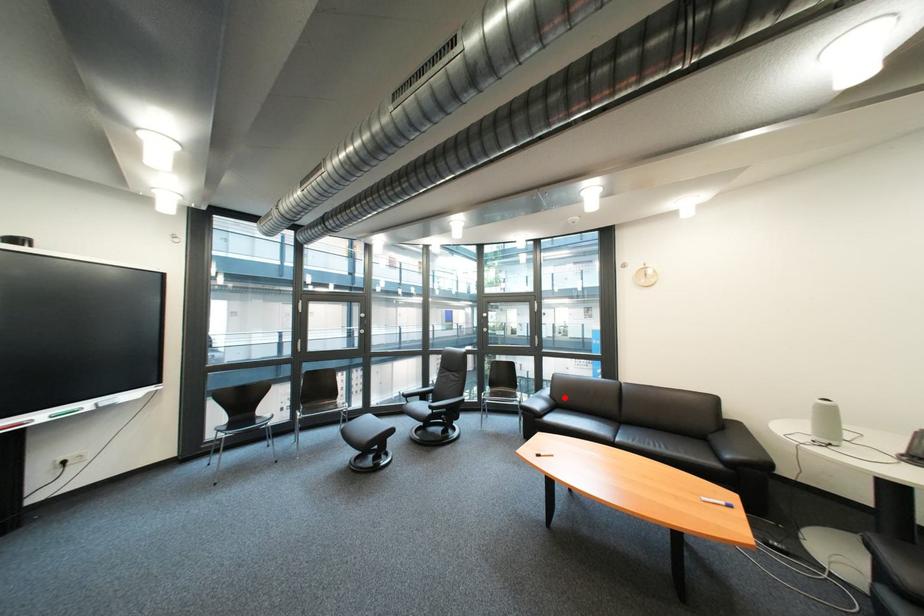
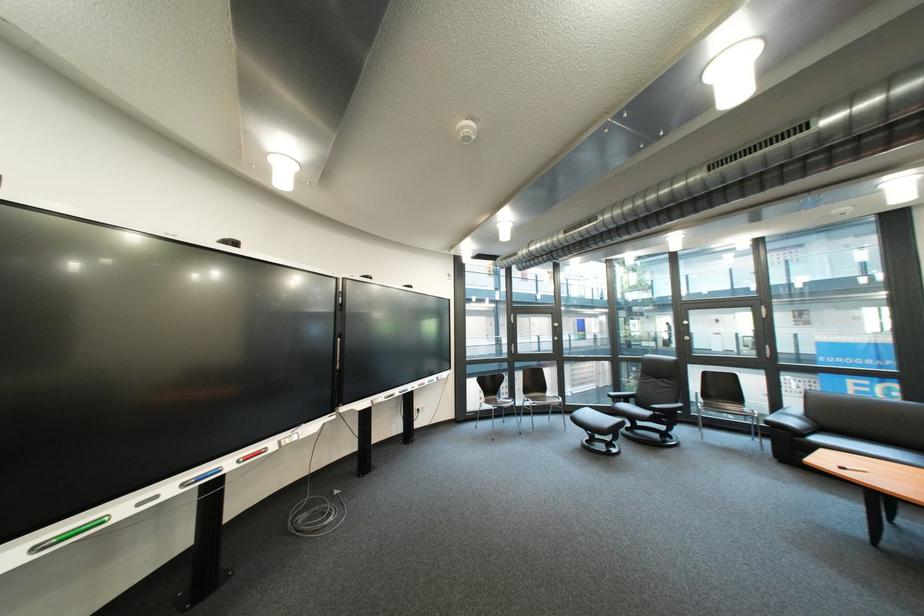
Find the pixel in the second image that matches the highlighted location in the first image.

(822, 418)